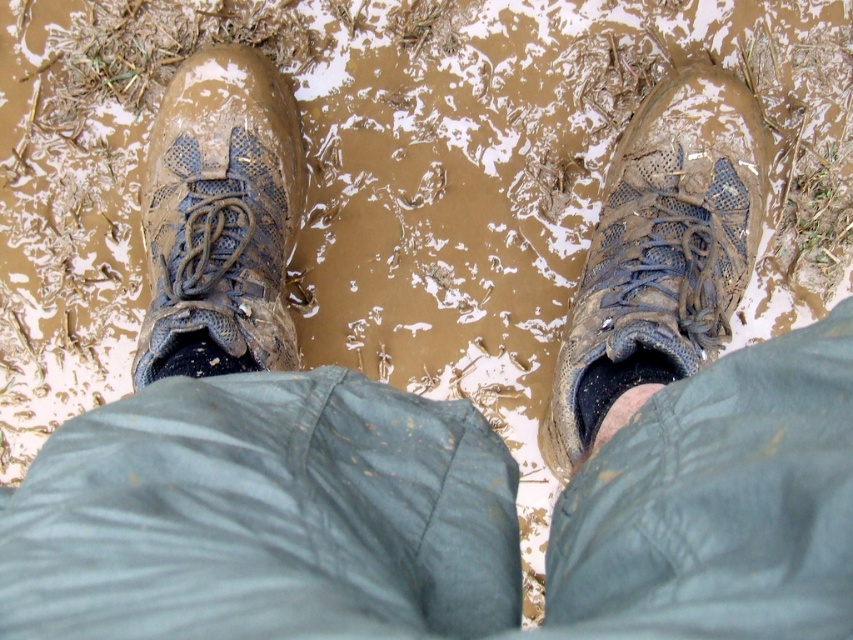
Question: Which of the following is the farthest from the observer?

Choices:
 (A) (148, 186)
 (B) (631, 380)

Answer: (A)

Question: Is muddy mesh boot at right wider than muddy textured boot at left?

Choices:
 (A) no
 (B) yes

Answer: (B)

Question: Can you confirm if muddy mesh boot at right is positioned above muddy textured boot at left?

Choices:
 (A) no
 (B) yes

Answer: (A)

Question: Which point is closer to the camera taking this photo?

Choices:
 (A) (157, 316)
 (B) (712, 241)

Answer: (A)

Question: Which of the following is the closest to the observer?

Choices:
 (A) muddy textured boot at left
 (B) muddy mesh boot at right

Answer: (B)

Question: Does muddy mesh boot at right lie behind muddy textured boot at left?

Choices:
 (A) yes
 (B) no

Answer: (B)